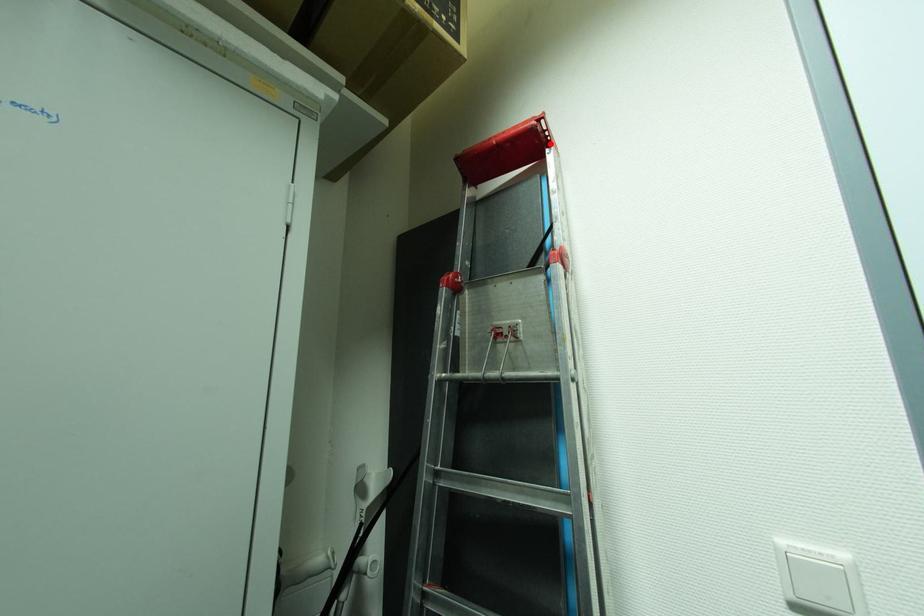
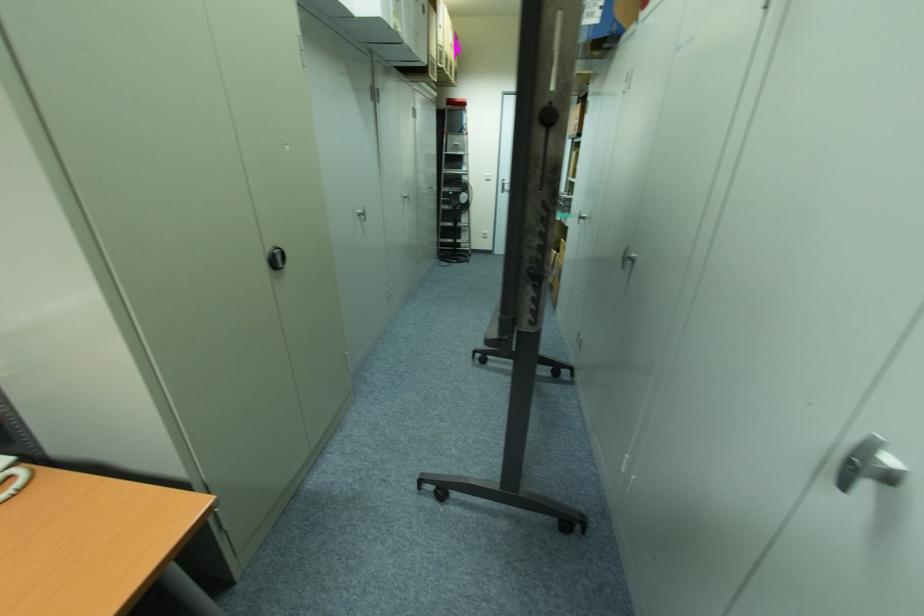
The point at the highlighted location is marked in the first image. Where is the corresponding point in the second image?

(468, 108)